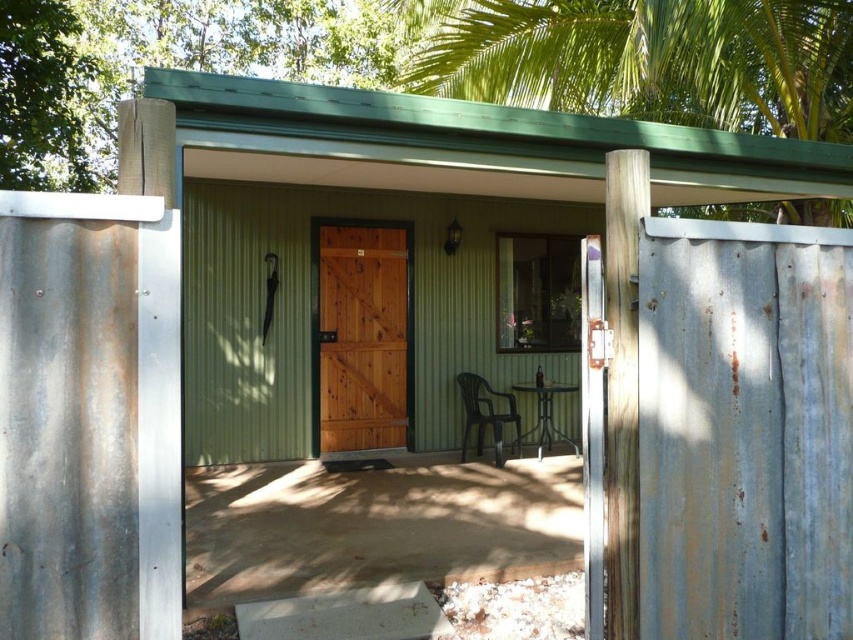
You are trying to move the black plastic chair at center through the wooden door at center. Based on their widths, will the chair fit through the door?

The wooden door at center is wider than the black plastic chair at center, so the chair can fit through the door.

Looking at this image, you are standing at the entrance of the cabin and want to move towards the black plastic chair at center. Is the green leafy palm tree at upper center in your direct path?

The green leafy palm tree at upper center is 3.73 meters away from the black plastic chair at center. Since you are moving towards the chair from the entrance, the palm tree is not in your direct path as it is positioned above the chair, not directly in front of it.